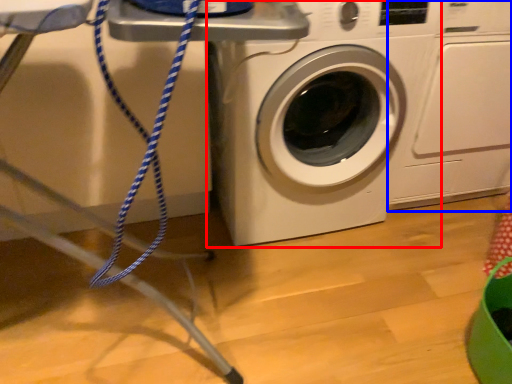
Question: Which of the following is the closest to the observer, washing machine (highlighted by a red box) or washing machine (highlighted by a blue box)?

Choices:
 (A) washing machine
 (B) washing machine

Answer: (A)